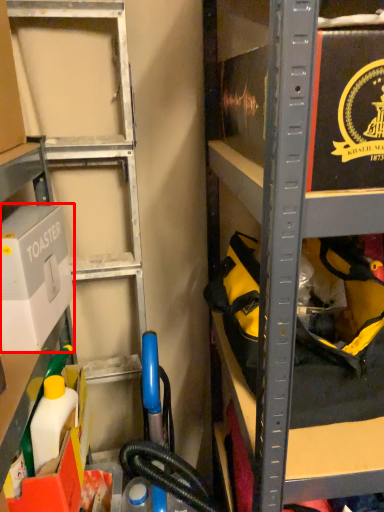
Question: In this image, where is box (annotated by the red box) located relative to box?

Choices:
 (A) left
 (B) right

Answer: (A)